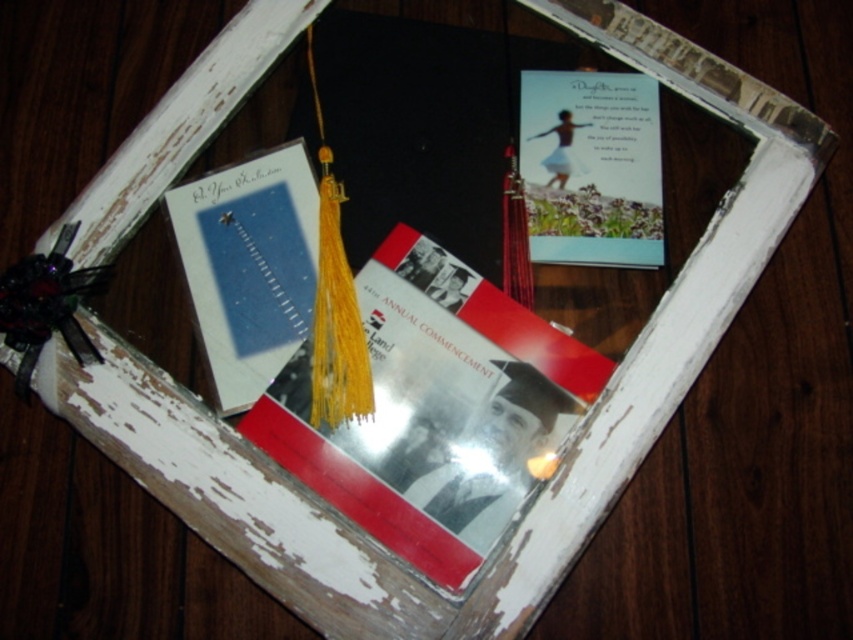
Question: Is white paper card at left smaller than black silky tassel at lower left?

Choices:
 (A) no
 (B) yes

Answer: (A)

Question: Which point is closer to the camera?

Choices:
 (A) black silky tassel at lower left
 (B) matte paper book at center
 (C) white paper card at left
 (D) matte paper card at upper right

Answer: (B)

Question: Which is nearer to the matte paper card at upper right?

Choices:
 (A) matte paper book at center
 (B) black silky tassel at lower left
 (C) white paper card at left

Answer: (A)

Question: Can you confirm if matte paper book at center is positioned to the left of white paper card at left?

Choices:
 (A) no
 (B) yes

Answer: (A)

Question: Where is white paper card at left located in relation to matte paper card at upper right in the image?

Choices:
 (A) right
 (B) left

Answer: (B)

Question: Estimate the real-world distances between objects in this image. Which object is farther from the matte paper card at upper right?

Choices:
 (A) white paper card at left
 (B) matte paper book at center
 (C) black silky tassel at lower left

Answer: (C)